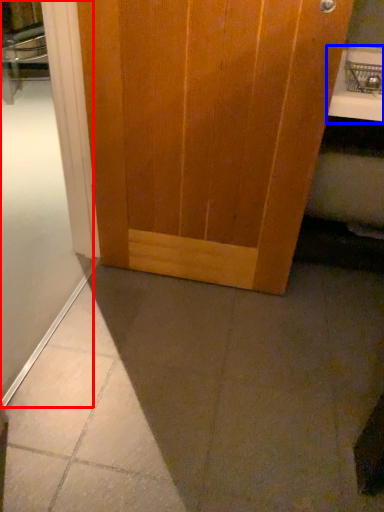
Question: Which object appears farthest to the camera in this image, shower door (highlighted by a red box) or counter top (highlighted by a blue box)?

Choices:
 (A) shower door
 (B) counter top

Answer: (B)